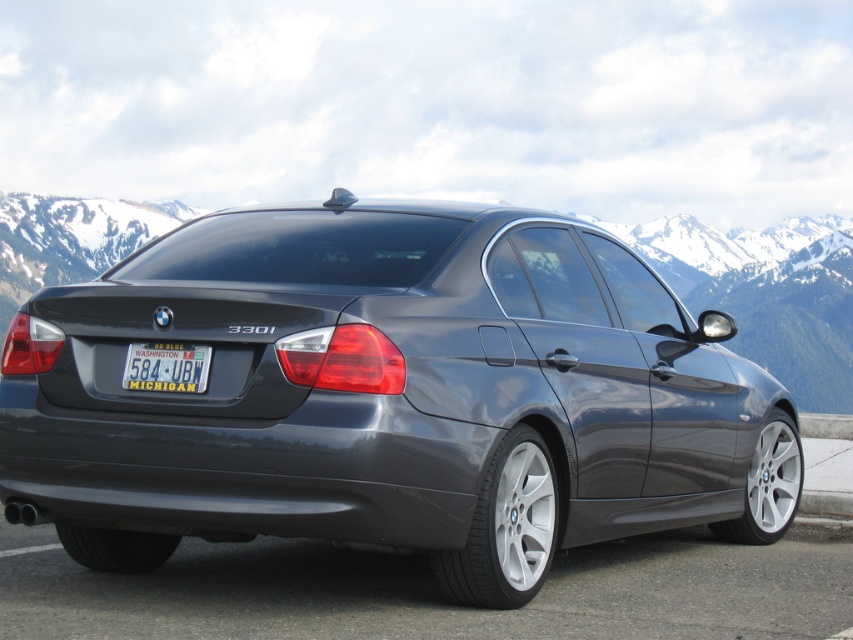
Does satin metallic sedan at center appear over yellowtexturedlicense plate at lower center?

No.

In the scene shown: Does satin metallic sedan at center appear under yellowtexturedlicense plate at lower center?

Indeed, satin metallic sedan at center is positioned under yellowtexturedlicense plate at lower center.

Between point (54, 493) and point (149, 356), which one is positioned behind?

Positioned behind is point (149, 356).

In order to click on satin metallic sedan at center in this screenshot , I will do `click(392, 396)`.